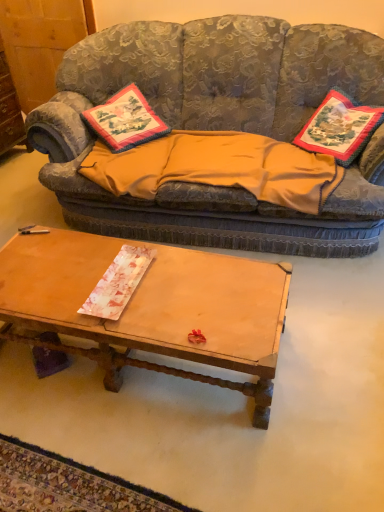
Locate an element on the screen. vacant area on top of wooden coffee table at center (from a real-world perspective) is located at coordinates (130, 281).